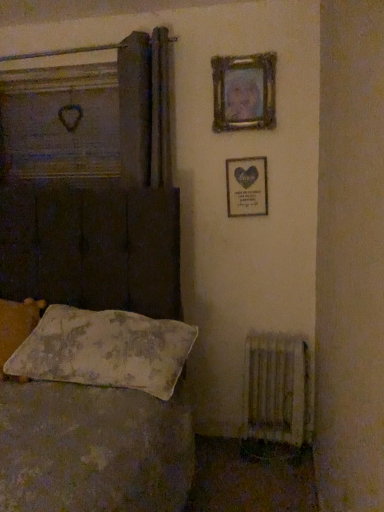
Question: Is wooden frame with heart at upper right, acting as the first picture frame starting from the bottom, oriented away from white textured radiator at lower right?

Choices:
 (A) yes
 (B) no

Answer: (B)

Question: Does wooden frame with heart at upper right, positioned as the second picture frame in top-to-bottom order, have a greater height compared to white textured radiator at lower right?

Choices:
 (A) yes
 (B) no

Answer: (B)

Question: Can you confirm if wooden frame with heart at upper right, positioned as the second picture frame in top-to-bottom order, is wider than white textured radiator at lower right?

Choices:
 (A) no
 (B) yes

Answer: (A)

Question: From the image's perspective, is wooden frame with heart at upper right, acting as the first picture frame starting from the bottom, under white textured radiator at lower right?

Choices:
 (A) no
 (B) yes

Answer: (A)

Question: Is wooden frame with heart at upper right, positioned as the second picture frame in top-to-bottom order, to the right of white textured radiator at lower right from the viewer's perspective?

Choices:
 (A) yes
 (B) no

Answer: (B)

Question: From the image's perspective, is floral fabric pillow at lower left, which is the 2th pillow from left to right, positioned above or below wooden frame at upper right, positioned as the second picture frame in bottom-to-top order?

Choices:
 (A) below
 (B) above

Answer: (A)

Question: Does point (187, 351) appear closer or farther from the camera than point (223, 69)?

Choices:
 (A) farther
 (B) closer

Answer: (B)

Question: From their relative heights in the image, would you say floral fabric pillow at lower left, which is the 2th pillow from left to right, is taller or shorter than wooden frame at upper right, positioned as the second picture frame in bottom-to-top order?

Choices:
 (A) short
 (B) tall

Answer: (A)

Question: Based on their positions, is floral fabric pillow at lower left, acting as the 1th pillow starting from the right, located to the left or right of wooden frame at upper right, positioned as the second picture frame in bottom-to-top order?

Choices:
 (A) left
 (B) right

Answer: (A)

Question: In the image, is wooden frame at upper right, positioned as the second picture frame in bottom-to-top order, on the left side or the right side of fluffy white pillow at lower left, which ranks as the second pillow in right-to-left order?

Choices:
 (A) left
 (B) right

Answer: (B)

Question: From a real-world perspective, relative to fluffy white pillow at lower left, which ranks as the second pillow in right-to-left order, is wooden frame at upper right, positioned as the second picture frame in bottom-to-top order, vertically above or below?

Choices:
 (A) above
 (B) below

Answer: (A)

Question: Relative to fluffy white pillow at lower left, which ranks as the second pillow in right-to-left order, is wooden frame at upper right, arranged as the first picture frame when viewed from the top, in front or behind?

Choices:
 (A) front
 (B) behind

Answer: (B)

Question: From the image's perspective, is wooden frame at upper right, positioned as the second picture frame in bottom-to-top order, positioned above or below fluffy white pillow at lower left, placed as the first pillow when sorted from left to right?

Choices:
 (A) below
 (B) above

Answer: (B)

Question: From a real-world perspective, is wooden frame at upper right, arranged as the first picture frame when viewed from the top, physically located above or below white textured radiator at lower right?

Choices:
 (A) above
 (B) below

Answer: (A)

Question: Which is correct: wooden frame at upper right, positioned as the second picture frame in bottom-to-top order, is inside white textured radiator at lower right, or outside of it?

Choices:
 (A) outside
 (B) inside

Answer: (A)